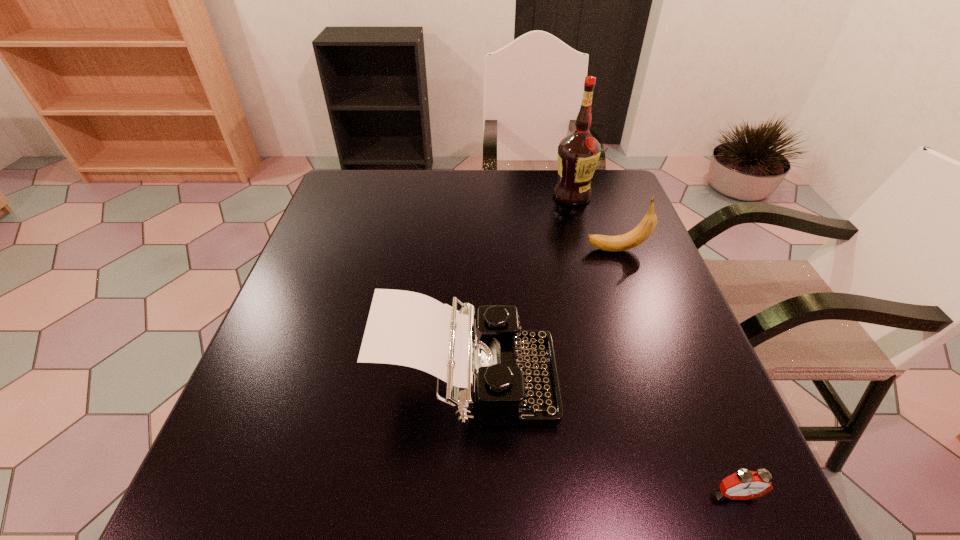
Identify the location of the tallest object. The image size is (960, 540). (578, 153).

Where is `alcohol`? This screenshot has height=540, width=960. alcohol is located at coordinates (578, 153).

Find the location of a particular element. the leftmost object is located at coordinates 515,372.

The image size is (960, 540). Find the location of `the third farthest object`. the third farthest object is located at coordinates (515, 372).

At what (x,y) coordinates should I click in order to perform the action: click on the second farthest object. Please return your answer as a coordinate pair (x, y). The width and height of the screenshot is (960, 540). Looking at the image, I should click on (645, 228).

Locate an element on the screen. The image size is (960, 540). alarm clock is located at coordinates (743, 485).

The image size is (960, 540). I want to click on the shortest object, so click(743, 485).

Where is `vacant point located 0.050m on the label of the tallest object`? vacant point located 0.050m on the label of the tallest object is located at coordinates (578, 217).

Image resolution: width=960 pixels, height=540 pixels. Find the location of `blank space located on the keys of the leftmost object`. blank space located on the keys of the leftmost object is located at coordinates (646, 383).

At what (x,y) coordinates should I click in order to perform the action: click on vacant space located at the start of the peel on the second farthest object. Please return your answer as a coordinate pair (x, y). The width and height of the screenshot is (960, 540). Looking at the image, I should click on (483, 250).